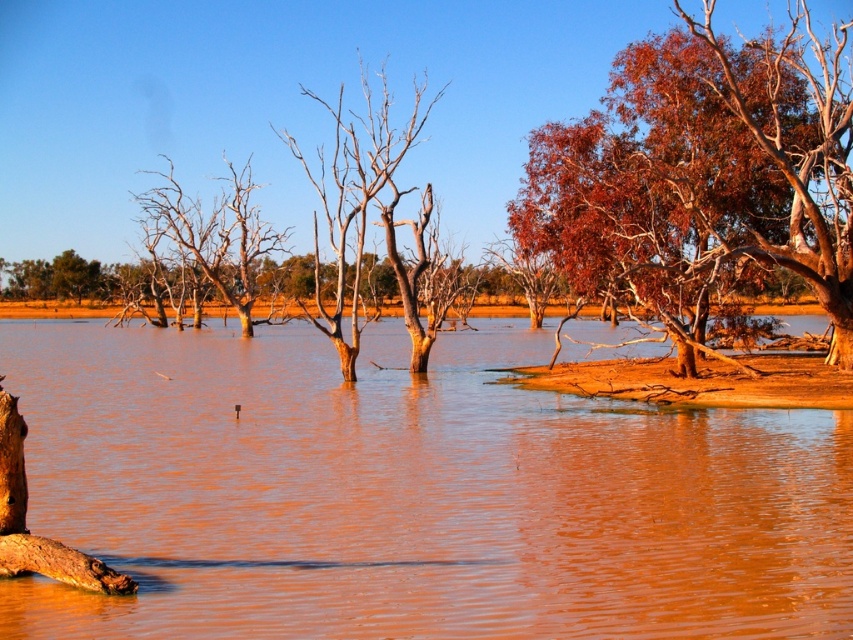
You are standing on the edge of the water and want to cross to the other side. The brown muddy water at center and the smooth bark tree at center are in your path. Which one should you avoid stepping on to safely cross the water?

You should avoid stepping on the smooth bark tree at center because the brown muddy water at center is smaller and might be shallower, making it safer to cross.